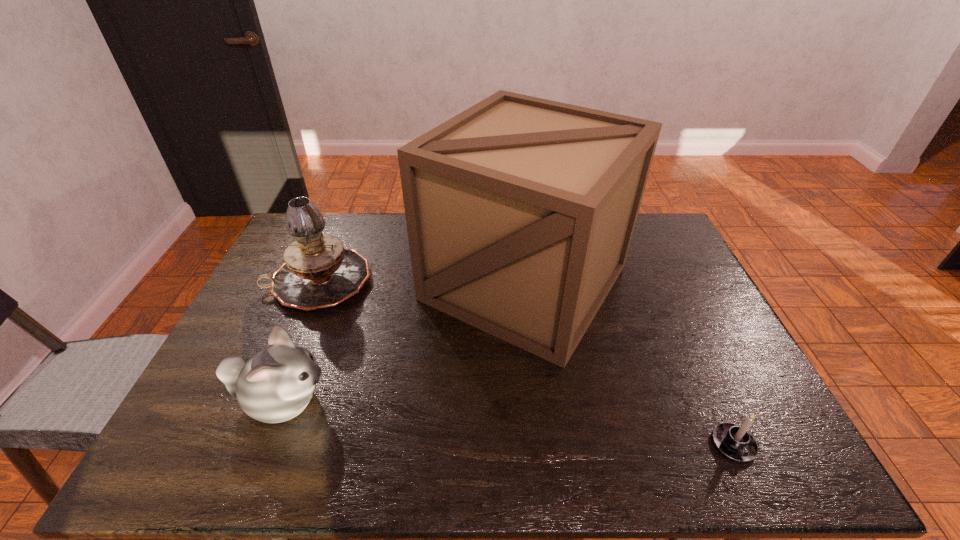
At what (x,y) coordinates should I click in order to perform the action: click on the third object from left to right. Please return your answer as a coordinate pair (x, y). The image size is (960, 540). Looking at the image, I should click on (520, 211).

At what (x,y) coordinates should I click in order to perform the action: click on the tallest object. Please return your answer as a coordinate pair (x, y). This screenshot has width=960, height=540. Looking at the image, I should click on (520, 211).

Locate an element on the screen. This screenshot has width=960, height=540. oil lamp is located at coordinates (318, 272).

Locate an element on the screen. This screenshot has width=960, height=540. hamster is located at coordinates (276, 384).

This screenshot has width=960, height=540. Find the location of `candle holder`. candle holder is located at coordinates (735, 442).

Locate an element on the screen. Image resolution: width=960 pixels, height=540 pixels. the rightmost object is located at coordinates (735, 442).

This screenshot has height=540, width=960. I want to click on vacant area located on the right of the second object from right to left, so 649,282.

Find the location of a particular element. Image resolution: width=960 pixels, height=540 pixels. blank area located 0.110m on the right of the oil lamp is located at coordinates (405, 281).

Where is `vacant space located on the face of the hamster`? This screenshot has width=960, height=540. vacant space located on the face of the hamster is located at coordinates (417, 402).

This screenshot has width=960, height=540. Identify the location of box that is at the far edge. (520, 211).